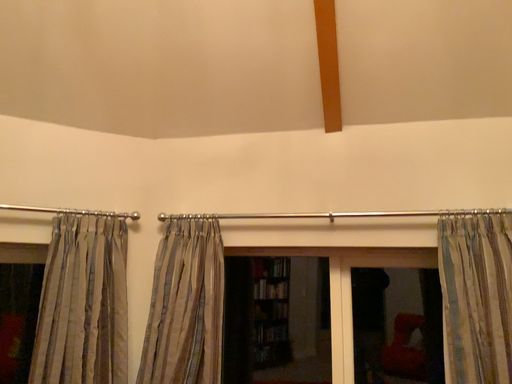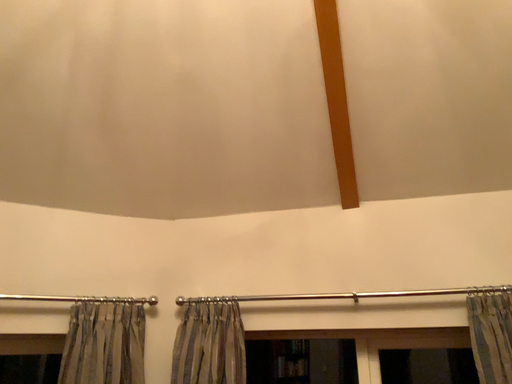
Question: How did the camera likely rotate when shooting the video?

Choices:
 (A) rotated upward
 (B) rotated downward

Answer: (A)